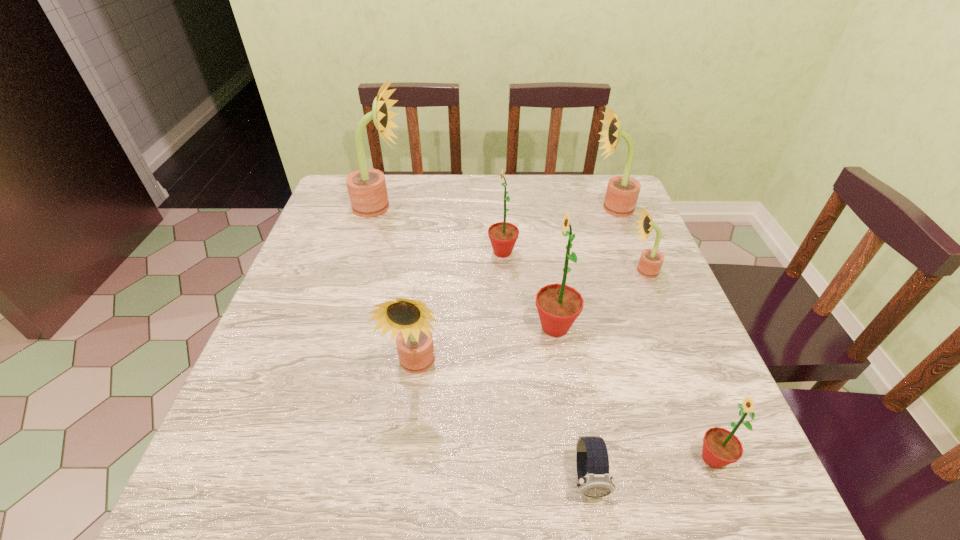
This screenshot has width=960, height=540. What are the coordinates of `free space at the right edge` in the screenshot? It's located at (656, 358).

This screenshot has height=540, width=960. In the image, there is a desktop. In order to click on vacant space at the near left corner in this screenshot , I will do `click(260, 498)`.

You are a GUI agent. You are given a task and a screenshot of the screen. Output one action in this format:
    pyautogui.click(x=<x>, y=<y>)
    Task: Click on the free spot between the third biggest yellow sunflower and the biggest yellow sunflower
    The height and width of the screenshot is (540, 960).
    Given the screenshot: What is the action you would take?
    pyautogui.click(x=397, y=286)

Where is `vacant space that is in between the smallest green sunflower and the second nearest yellow sunflower`? This screenshot has width=960, height=540. vacant space that is in between the smallest green sunflower and the second nearest yellow sunflower is located at coordinates (678, 364).

What are the coordinates of `free space between the smallest green sunflower and the watch` in the screenshot? It's located at (650, 469).

The image size is (960, 540). I want to click on empty location between the fifth sunflower from right to left and the third smallest yellow sunflower, so click(x=557, y=230).

Find the location of a particular element. Image resolution: width=960 pixels, height=540 pixels. blank region between the third object from left to right and the nearest green sunflower is located at coordinates (608, 355).

This screenshot has height=540, width=960. I want to click on free space between the nearest green sunflower and the watch, so click(650, 469).

Find the location of a particular element. free point between the nearest yellow sunflower and the second biggest yellow sunflower is located at coordinates (515, 287).

Locate an element on the screen. Image resolution: width=960 pixels, height=540 pixels. free space between the second biggest yellow sunflower and the biggest yellow sunflower is located at coordinates (495, 207).